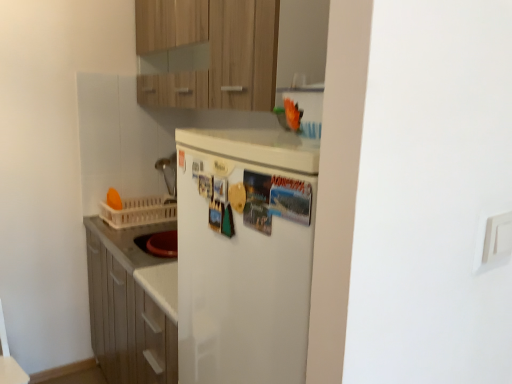
Question: From a real-world perspective, is white plastic basket at left above or below wooden cabinet at upper center?

Choices:
 (A) below
 (B) above

Answer: (A)

Question: Relative to wooden cabinet at upper center, is white plastic basket at left in front or behind?

Choices:
 (A) behind
 (B) front

Answer: (A)

Question: Which of these objects is positioned farthest from the wooden cabinet at upper center?

Choices:
 (A) white plastic basket at left
 (B) white matte refrigerator at center

Answer: (A)

Question: Estimate the real-world distances between objects in this image. Which object is closer to the white matte refrigerator at center?

Choices:
 (A) white plastic basket at left
 (B) wooden cabinet at upper center

Answer: (B)